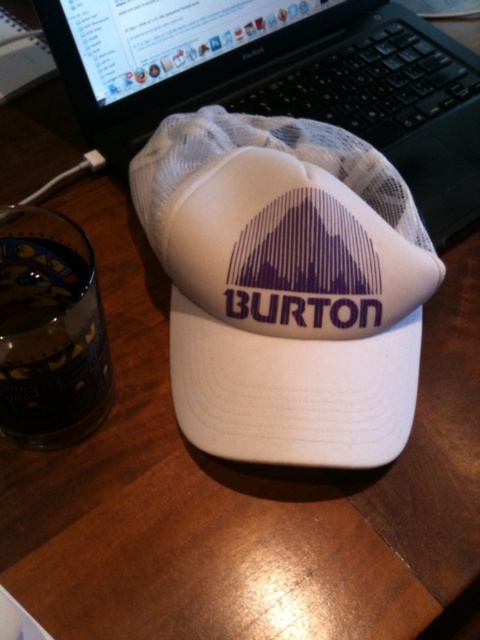
Image resolution: width=480 pixels, height=640 pixels. Describe the element at coordinates (286, 285) in the screenshot. I see `white mesh hat at center` at that location.

Is point (192, 381) positioned after point (335, 44)?

No.

What are the coordinates of `white mesh hat at center` in the screenshot? It's located at (286, 285).

The height and width of the screenshot is (640, 480). I want to click on white mesh hat at center, so pos(286,285).